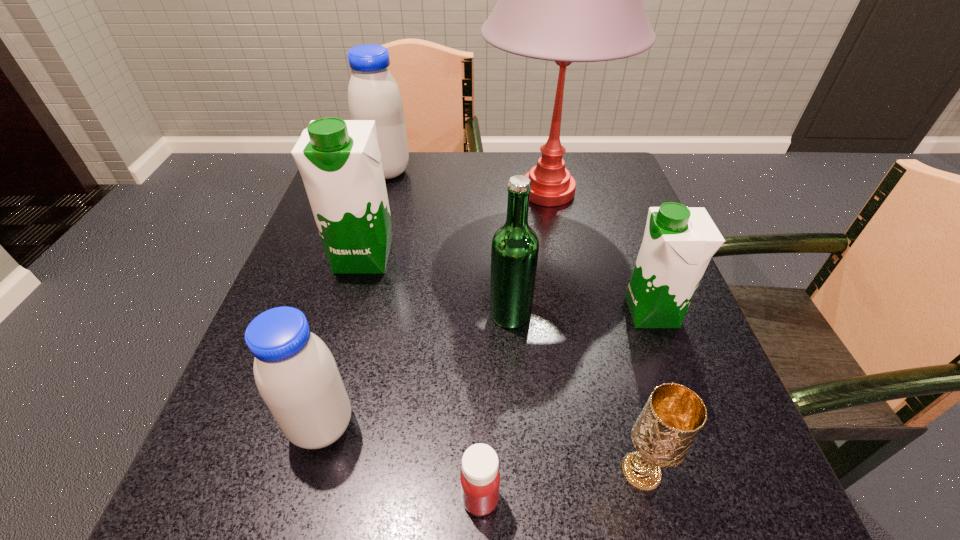
The height and width of the screenshot is (540, 960). What are the coordinates of `the smaller blue soya milk` in the screenshot? It's located at (296, 374).

What are the coordinates of `the second shortest object` in the screenshot? It's located at (673, 416).

The image size is (960, 540). What are the coordinates of `red medicine` in the screenshot? It's located at (480, 478).

Locate an element on the screen. This screenshot has width=960, height=540. the shortest object is located at coordinates (480, 478).

The height and width of the screenshot is (540, 960). What are the coordinates of `free region located on the front-facing side of the table lamp` in the screenshot? It's located at (580, 357).

You are a GUI agent. You are given a task and a screenshot of the screen. Output one action in this format:
    pyautogui.click(x=<x>, y=<y>)
    Task: Click on the vacant space located on the front-facing side of the second farthest soya milk
    
    Given the screenshot: What is the action you would take?
    pyautogui.click(x=328, y=380)

At what (x,y) coordinates should I click in order to perform the action: click on free location located on the right of the farther blue soya milk. Please return your answer as a coordinate pair (x, y). The height and width of the screenshot is (540, 960). Looking at the image, I should click on (540, 172).

The height and width of the screenshot is (540, 960). I want to click on free space located on the left of the green beer bottle, so click(x=413, y=314).

Find the location of `vacant space located on the front-facing side of the smaller green soya milk`. vacant space located on the front-facing side of the smaller green soya milk is located at coordinates (509, 312).

The height and width of the screenshot is (540, 960). I want to click on vacant space located 0.330m on the front-facing side of the smaller green soya milk, so click(x=443, y=312).